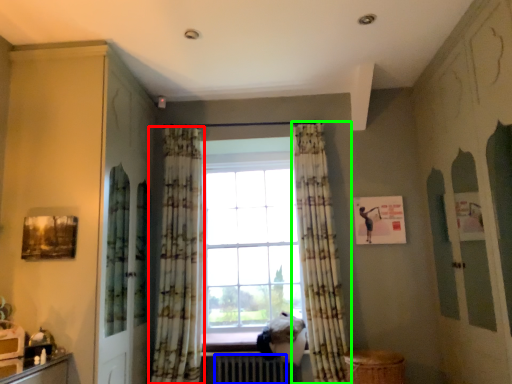
Question: Which is farther away from curtain (highlighted by a red box)? radiator (highlighted by a blue box) or curtain (highlighted by a green box)?

Choices:
 (A) radiator
 (B) curtain

Answer: (B)